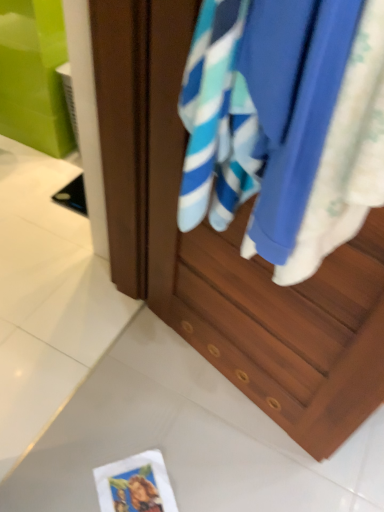
Locate an element on the screen. vacant area that lies between wooden cabinet at center and white paper postcard at lower center is located at coordinates (192, 416).